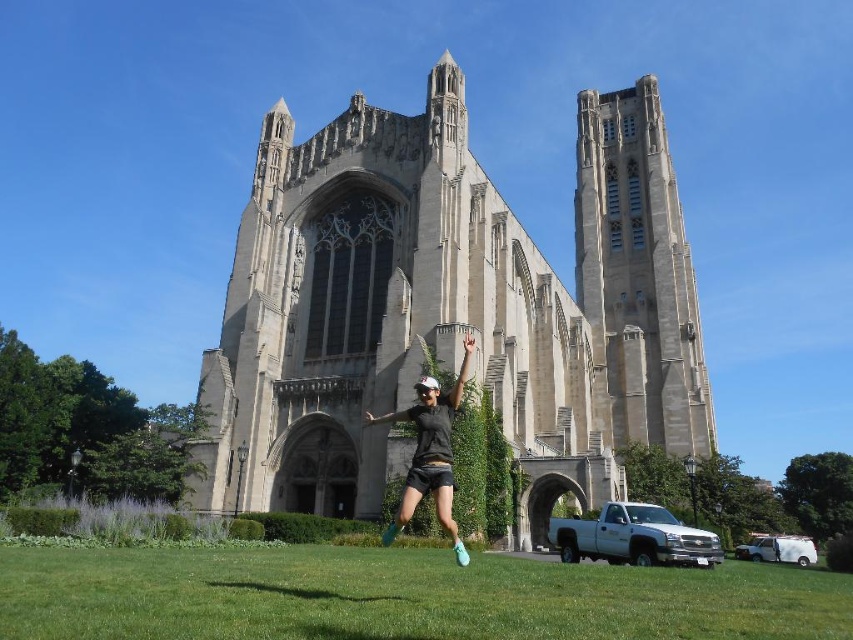
You are a photographer planning to capture the stone church at center and the black matte shorts at center in a single frame. Based on their positions, which object is positioned further to the left?

The stone church at center is positioned further to the left than the black matte shorts at center.

You are a photographer aiming to capture the stone church at center while ensuring the black matte shorts at center in the foreground doesn not block the view. Given their sizes, is it possible to frame the shot so both are visible without overlap?

The stone church at center is larger in size than the black matte shorts at center. However, since the church is at the center and the shorts are also at the center, their positions might overlap, making it challenging to frame both without one blocking the other.